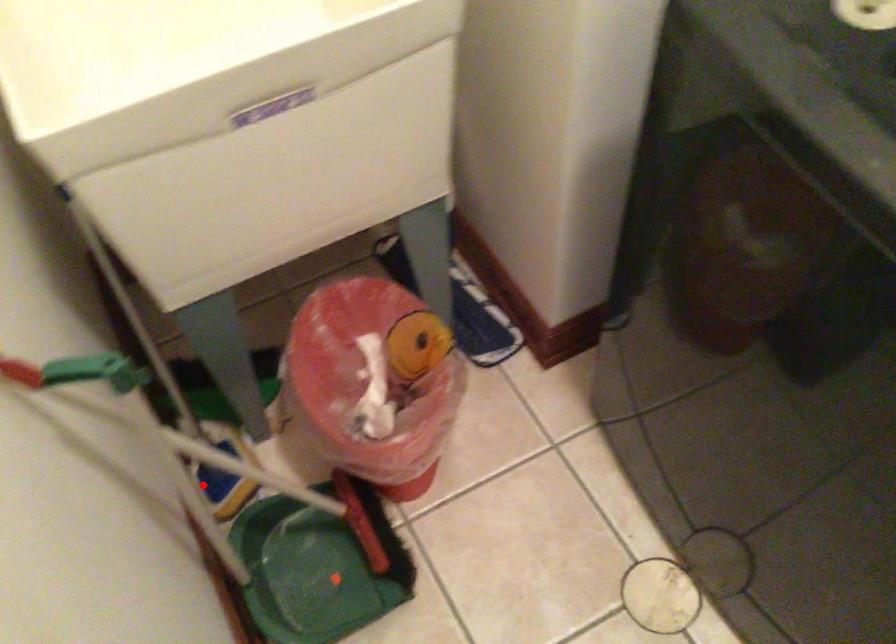
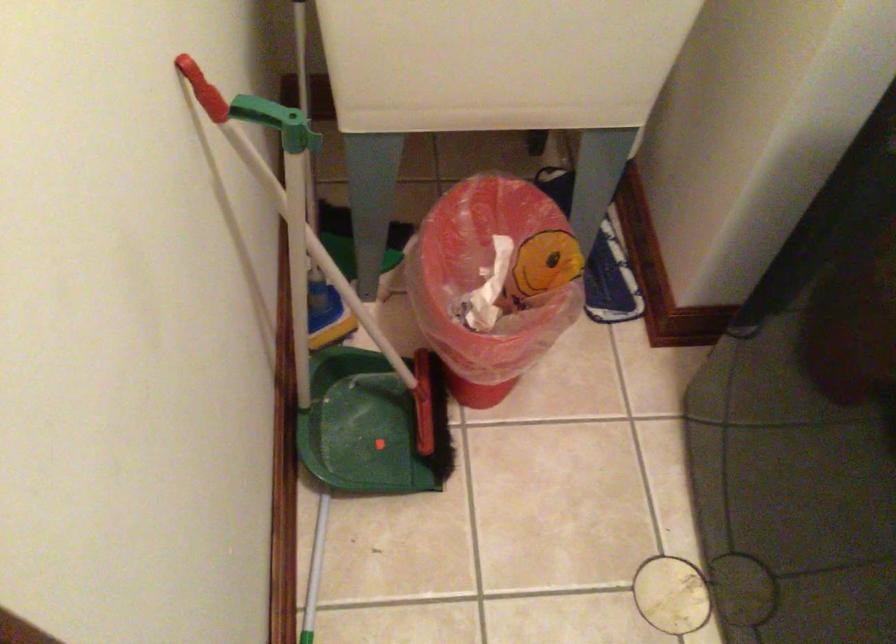
Question: I am providing you with two images of the same scene from different viewpoints. A red point is marked on the first image. At the location where the point appears in image 1, is it still visible in image 2?

Choices:
 (A) Yes
 (B) No

Answer: (B)